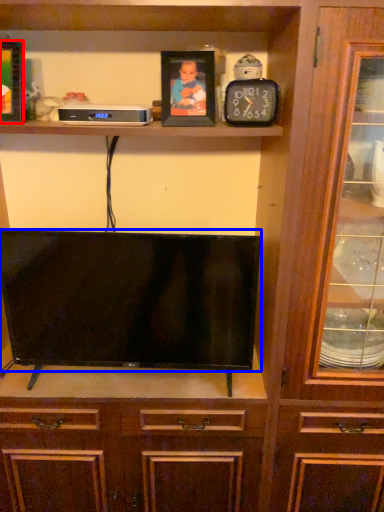
Question: Which of the following is the farthest to the observer, picture frame (highlighted by a red box) or television (highlighted by a blue box)?

Choices:
 (A) picture frame
 (B) television

Answer: (B)